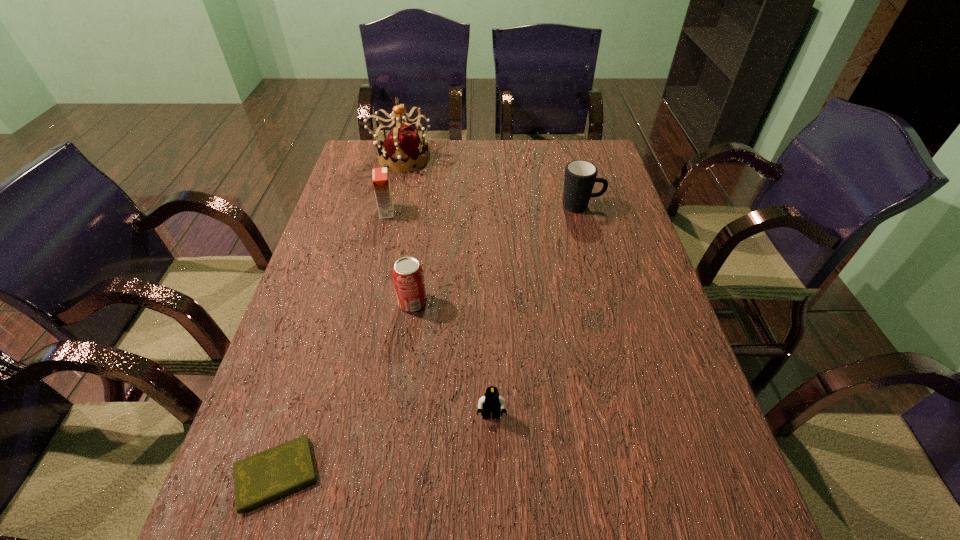
Where is `free space between the orange juice and the tiara`? free space between the orange juice and the tiara is located at coordinates (395, 185).

The height and width of the screenshot is (540, 960). Identify the location of vacant area that lies between the Lego and the shortest object. (384, 446).

At what (x,y) coordinates should I click in order to perform the action: click on free spot between the tiara and the third nearest object. Please return your answer as a coordinate pair (x, y). This screenshot has height=540, width=960. Looking at the image, I should click on [x=407, y=231].

Locate an element on the screen. The image size is (960, 540). blank region between the tallest object and the mug is located at coordinates (492, 182).

What are the coordinates of `vacant area that lies between the orange juice and the diary` in the screenshot? It's located at (332, 343).

Locate which object is the second closest to the mug. Please provide its 2D coordinates. Your answer should be formatted as a tuple, i.e. [(x, y)], where the tuple contains the x and y coordinates of a point satisfying the conditions above.

[(407, 273)]

Identify which object is the third closest to the soda can. Please provide its 2D coordinates. Your answer should be formatted as a tuple, i.e. [(x, y)], where the tuple contains the x and y coordinates of a point satisfying the conditions above.

[(272, 473)]

Where is `free region that satisfies the following two spatial constraints: 1. on the side of the mug with the handle; 2. on the front-facing side of the fifth farthest object`? free region that satisfies the following two spatial constraints: 1. on the side of the mug with the handle; 2. on the front-facing side of the fifth farthest object is located at coordinates (636, 416).

Locate an element on the screen. This screenshot has width=960, height=540. blank space that satisfies the following two spatial constraints: 1. on the side of the mug with the handle; 2. on the front-facing side of the Lego is located at coordinates (636, 416).